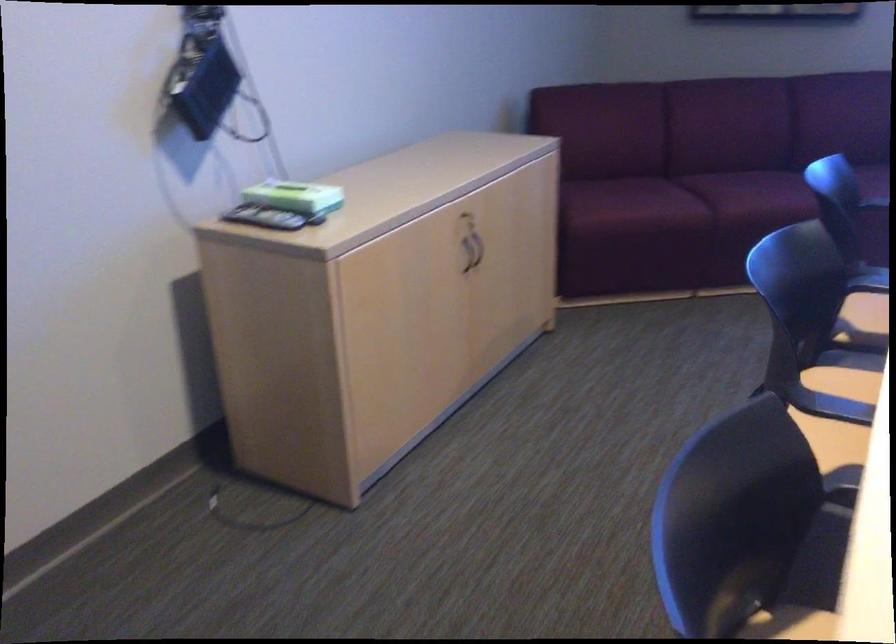
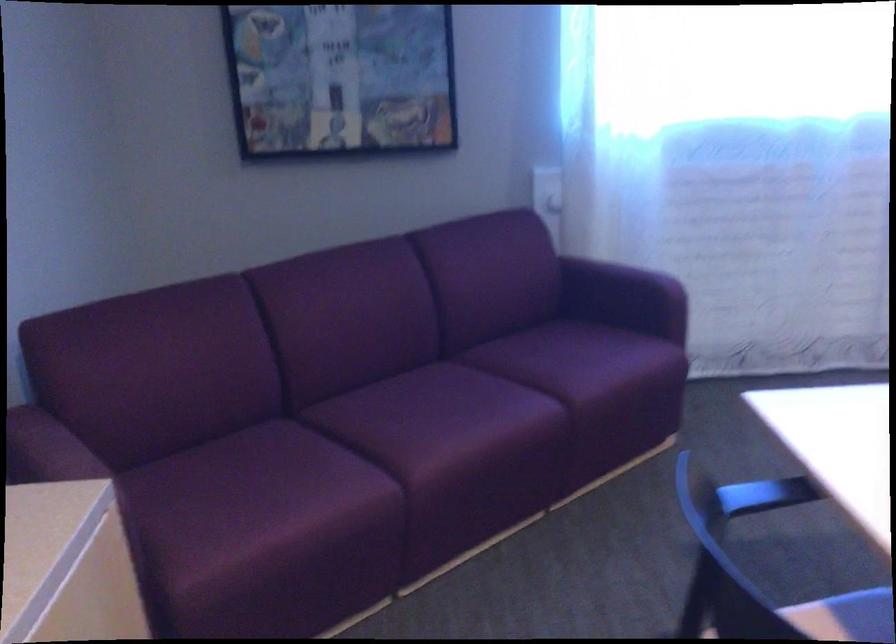
The point at [760,190] is marked in the first image. Where is the corresponding point in the second image?

(445, 422)